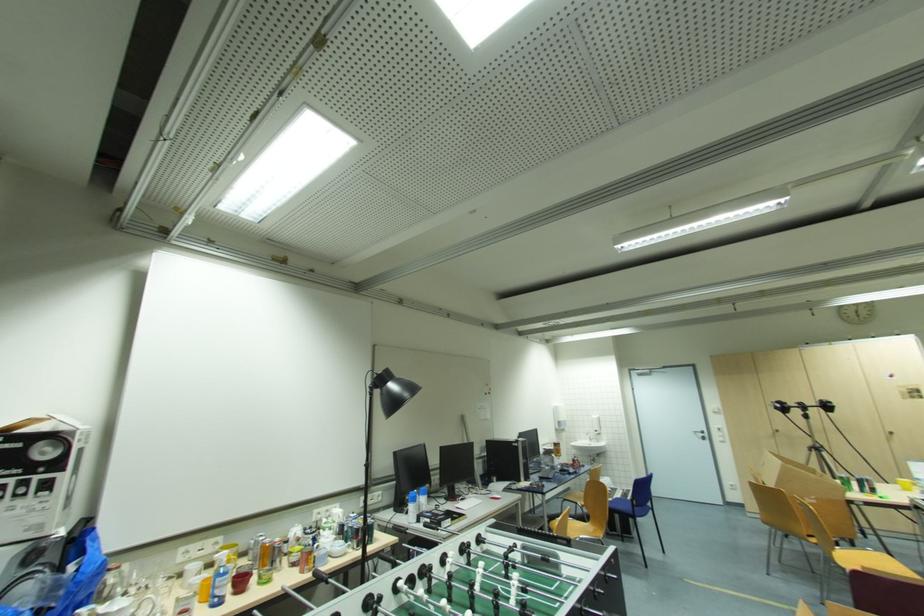
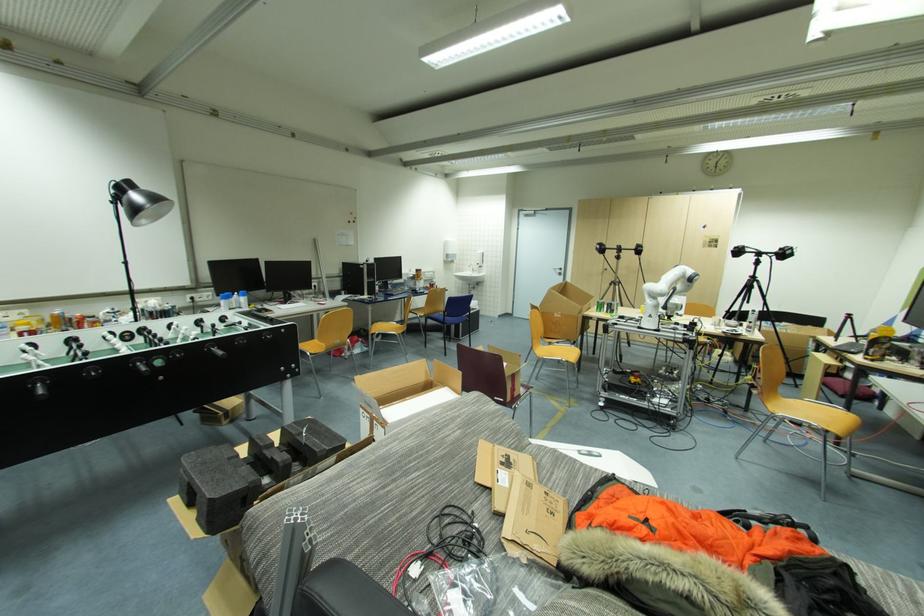
Question: The images are taken continuously from a first-person perspective. In which direction are you moving?

Choices:
 (A) Left
 (B) Right
 (C) Forward
 (D) Backward

Answer: (B)